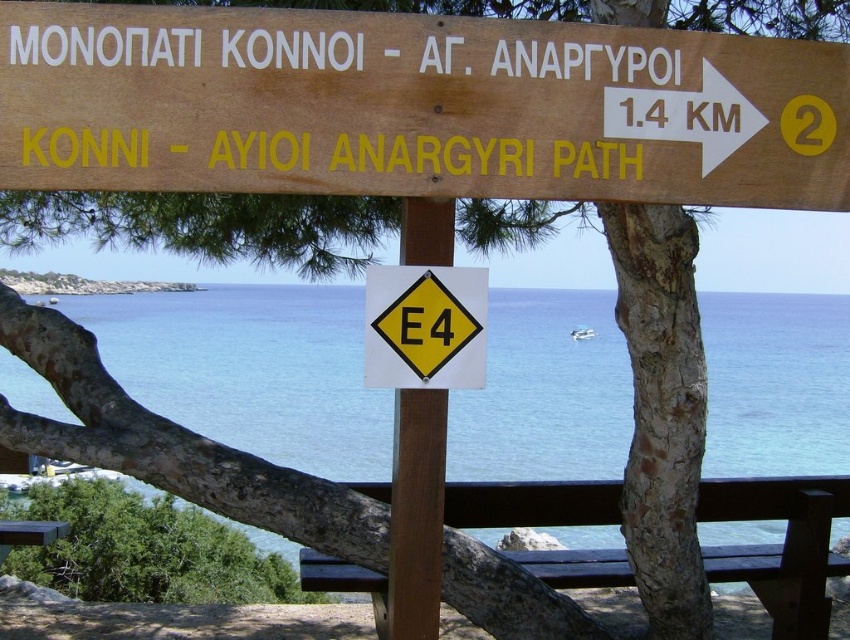
You are standing at the green painted wood picnic table at lower left and want to sit on the brown wooden bench at center. Which direction should you walk to reach it?

The brown wooden bench at center is to the right of the green painted wood picnic table at lower left, so you should walk to the right to reach it.